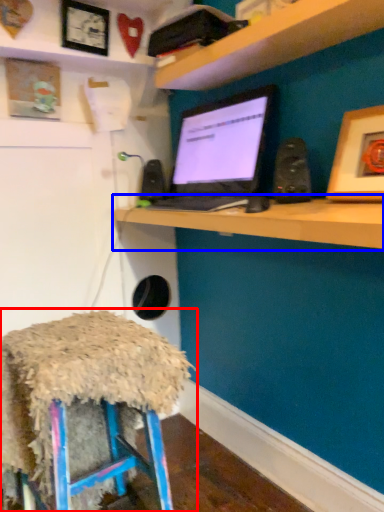
Question: Which object is closer to the camera taking this photo, stool (highlighted by a red box) or computer (highlighted by a blue box)?

Choices:
 (A) stool
 (B) computer

Answer: (B)